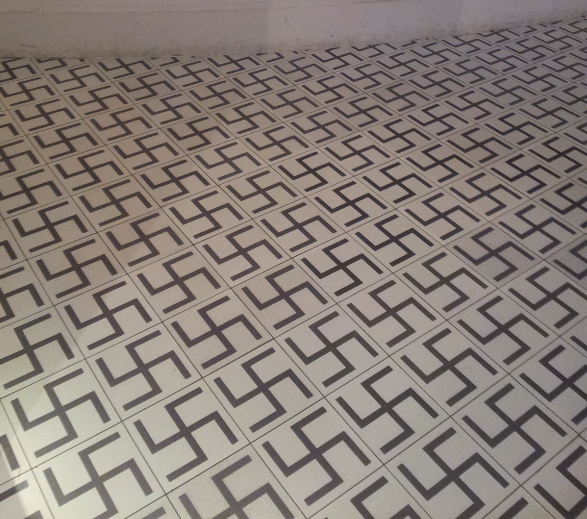
This screenshot has width=587, height=519. Find the location of `tile`. tile is located at coordinates (546, 179).